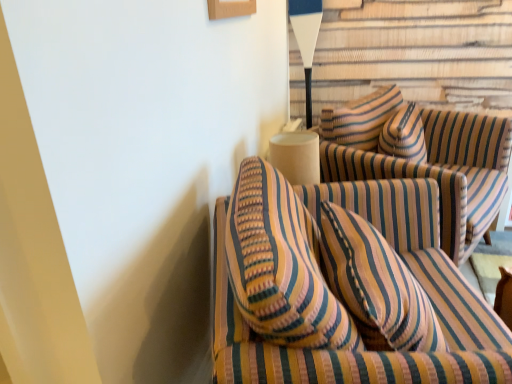
Question: From the image's perspective, is striped fabric couch at center, the first studio couch viewed from the back, positioned above or below striped fabric couch at center, which is the 1th studio couch in front-to-back order?

Choices:
 (A) below
 (B) above

Answer: (B)

Question: From a real-world perspective, is striped fabric couch at center, the first studio couch viewed from the back, physically located above or below striped fabric couch at center, placed as the 2th studio couch when sorted from back to front?

Choices:
 (A) above
 (B) below

Answer: (A)

Question: Which object is the closest to the white matte table lamp at upper center?

Choices:
 (A) striped fabric couch at center, the second studio couch viewed from the front
 (B) striped fabric couch at center, which is the 1th studio couch in front-to-back order

Answer: (A)

Question: Based on their relative distances, which object is nearer to the striped fabric couch at center, which is the 1th studio couch in front-to-back order?

Choices:
 (A) white matte table lamp at upper center
 (B) striped fabric couch at center, the second studio couch viewed from the front

Answer: (B)